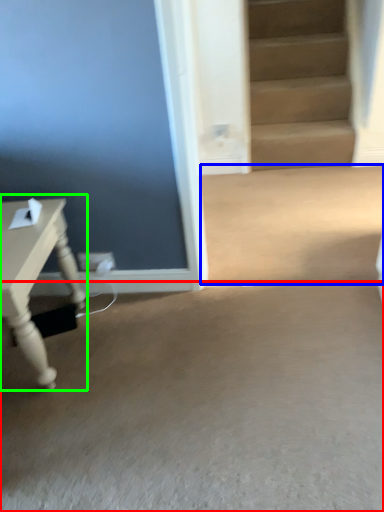
Question: Considering the real-world distances, which object is closest to concrete (highlighted by a red box)? concrete (highlighted by a blue box) or table (highlighted by a green box).

Choices:
 (A) concrete
 (B) table

Answer: (B)